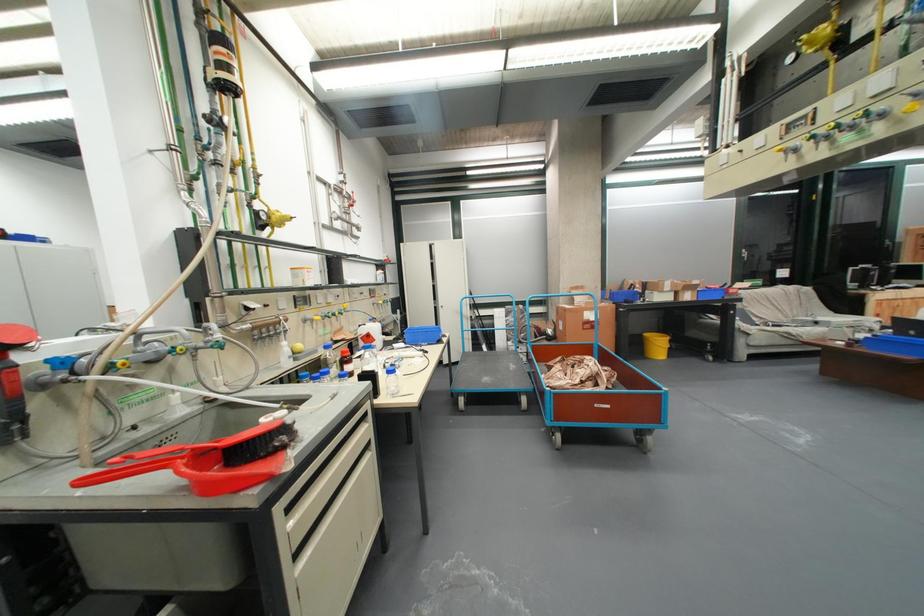
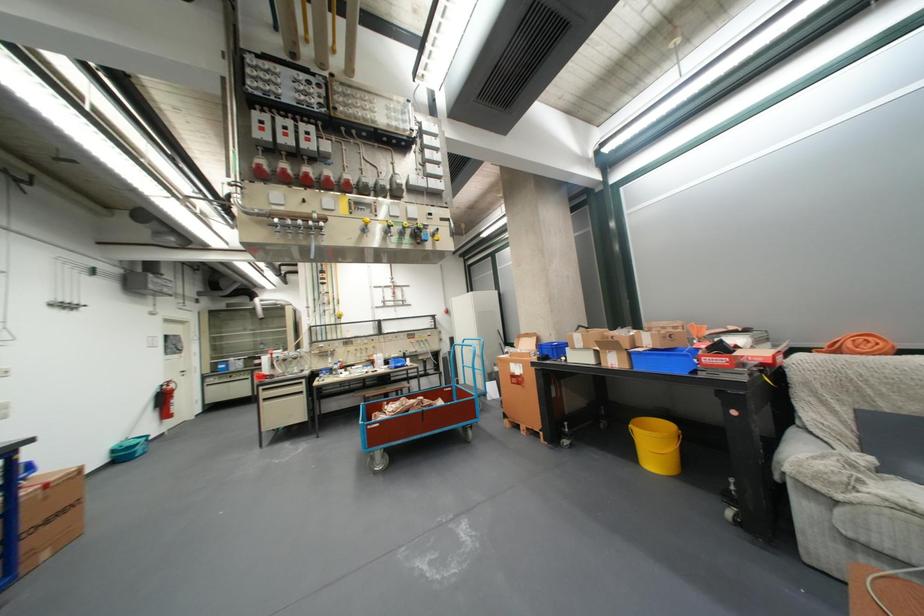
Locate, in the second image, the point that corresponds to the point at 707,300 in the first image.

(638, 368)